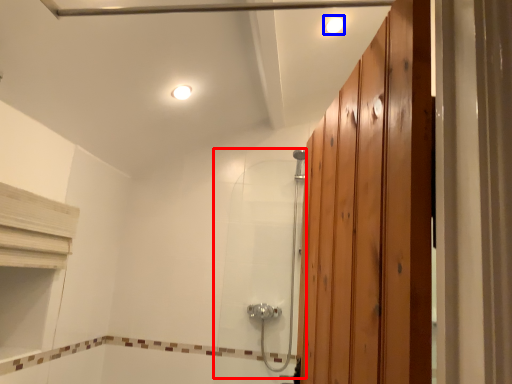
Question: Which of the following is the closest to the observer, shower door (highlighted by a red box) or light fixture (highlighted by a blue box)?

Choices:
 (A) shower door
 (B) light fixture

Answer: (B)